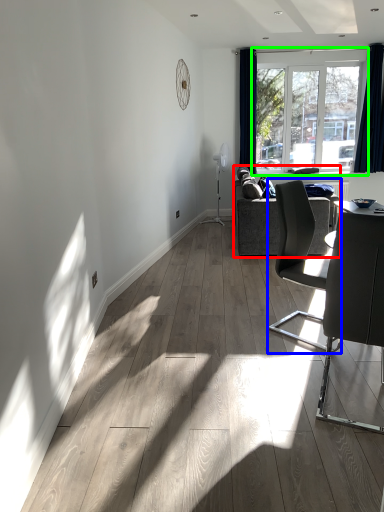
Question: Which object is the farthest from studio couch (highlighted by a red box)? Choose among these: chair (highlighted by a blue box) or window (highlighted by a green box).

Choices:
 (A) chair
 (B) window

Answer: (B)